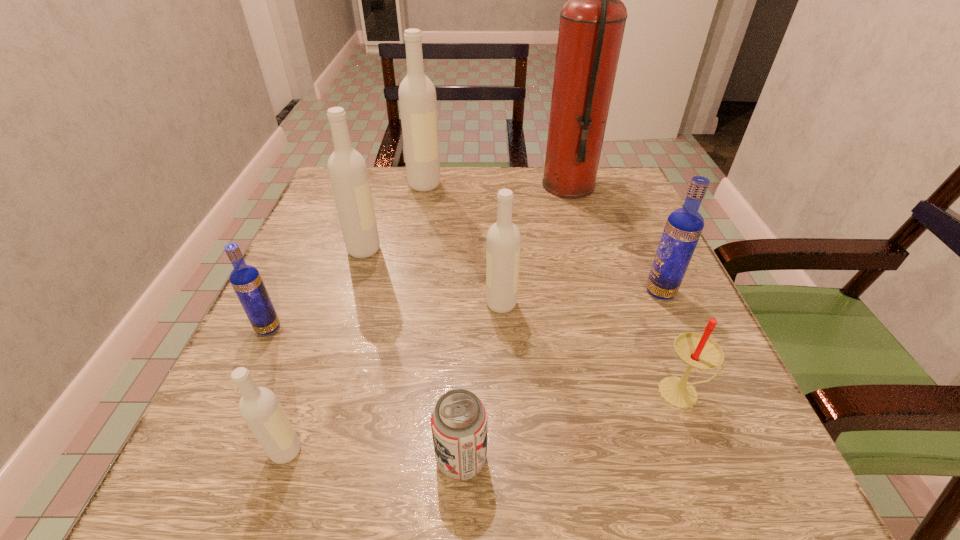
Where is `the left blue vodka`? The image size is (960, 540). the left blue vodka is located at coordinates (246, 280).

Find the location of `the sixth farthest object`. the sixth farthest object is located at coordinates (246, 280).

At what (x,y) coordinates should I click in order to perform the action: click on the smallest white vodka. Please return your answer as a coordinate pair (x, y). The width and height of the screenshot is (960, 540). Looking at the image, I should click on (259, 407).

Locate an element on the screen. Image resolution: width=960 pixels, height=540 pixels. the nearest vodka is located at coordinates (259, 407).

At what (x,y) coordinates should I click in order to perform the action: click on the seventh farthest object. Please return your answer as a coordinate pair (x, y). This screenshot has width=960, height=540. Looking at the image, I should click on (697, 350).

Find the location of a particular element. beer can is located at coordinates (459, 419).

The height and width of the screenshot is (540, 960). Find the location of `the shortest object`. the shortest object is located at coordinates (459, 419).

Identify the location of vacant space located 0.110m at the nozzle of the tallest object. (500, 185).

Where is `vacant region located 0.130m at the nozzle of the tallest object`? vacant region located 0.130m at the nozzle of the tallest object is located at coordinates (492, 185).

This screenshot has width=960, height=540. What are the coordinates of `vacant region located 0.220m at the nozzle of the tallest object` in the screenshot? It's located at (457, 185).